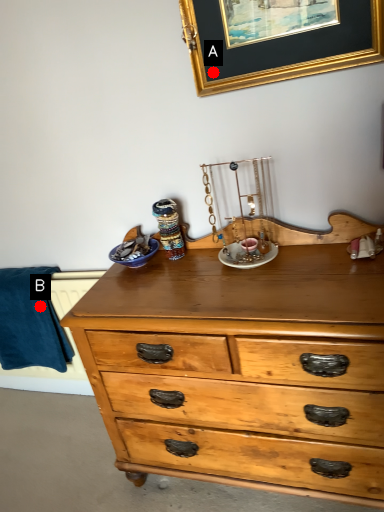
Question: Two points are circled on the image, labeled by A and B beside each circle. Which of the following is the farthest from the observer?

Choices:
 (A) A is further
 (B) B is further

Answer: (B)